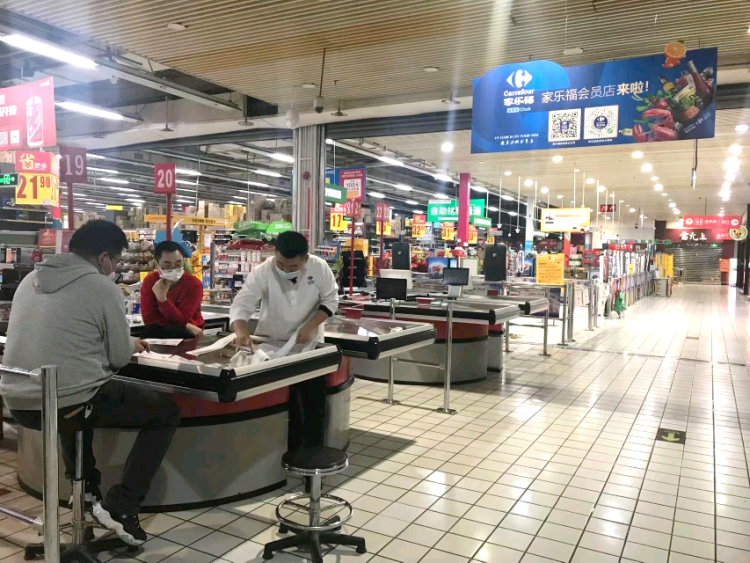
I want to click on tile, so click(x=620, y=406).